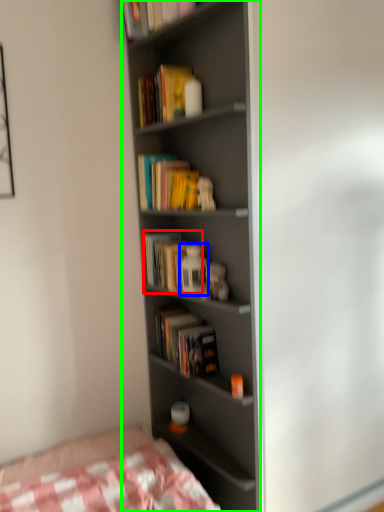
Question: Considering the real-world distances, which object is closest to book (highlighted by a red box)? toy (highlighted by a blue box) or bookcase (highlighted by a green box).

Choices:
 (A) toy
 (B) bookcase

Answer: (A)